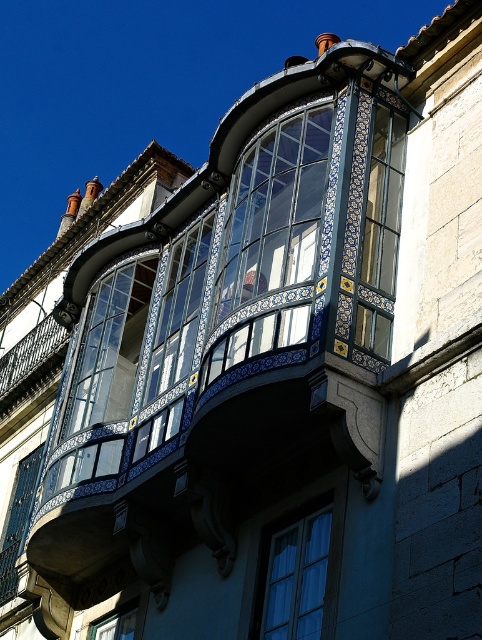
Is blue glass window at center smaller than clear glass window at lower center?

Actually, blue glass window at center might be larger than clear glass window at lower center.

Does blue glass window at center appear over clear glass window at lower center?

Yes, blue glass window at center is above clear glass window at lower center.

This screenshot has width=482, height=640. I want to click on blue glass window at center, so click(x=179, y=308).

This screenshot has width=482, height=640. What do you see at coordinates (230, 324) in the screenshot? I see `blue glass balcony at center` at bounding box center [230, 324].

Does blue glass balcony at center have a lesser height compared to blue glass window at center?

In fact, blue glass balcony at center may be taller than blue glass window at center.

Where is `blue glass balcony at center`? The height and width of the screenshot is (640, 482). blue glass balcony at center is located at coordinates (230, 324).

In the scene shown: Who is shorter, matte glass window at center or clear glass window at lower center?

clear glass window at lower center is shorter.

Can you confirm if matte glass window at center is shorter than clear glass window at lower center?

In fact, matte glass window at center may be taller than clear glass window at lower center.

Find the location of a particular element. Image resolution: width=482 pixels, height=640 pixels. matte glass window at center is located at coordinates point(380,234).